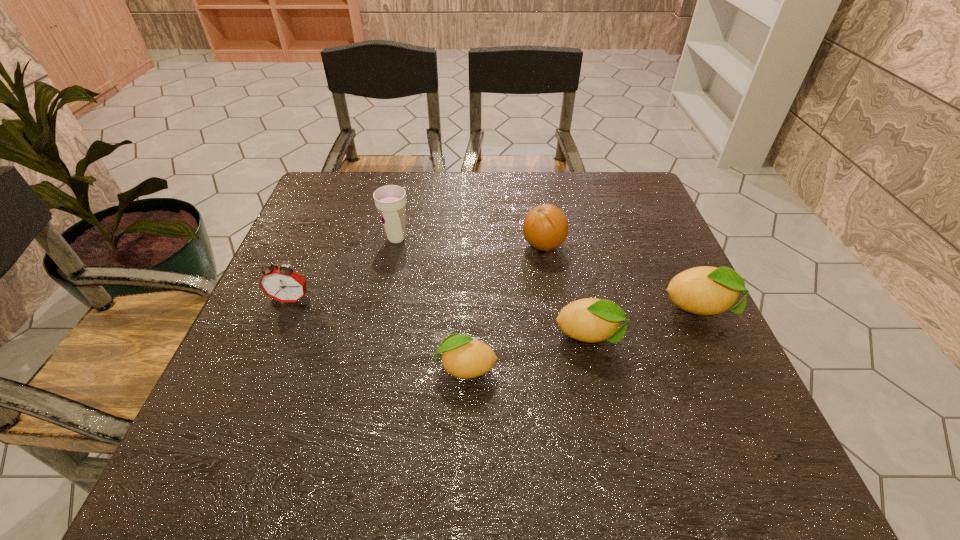
Find the location of `free area in between the fourth object from right to left and the alarm clock`. free area in between the fourth object from right to left and the alarm clock is located at coordinates (378, 334).

The width and height of the screenshot is (960, 540). Identify the location of vacant space in between the orange and the rightmost object. (622, 278).

I want to click on vacant space that is in between the orange and the shortest lemon, so click(x=504, y=306).

I want to click on the second closest object relative to the orange, so click(x=705, y=290).

This screenshot has width=960, height=540. Find the location of `the closest object to the cup`. the closest object to the cup is located at coordinates (283, 284).

Where is `lemon that is the second closest to the fifth object from right to left`? This screenshot has height=540, width=960. lemon that is the second closest to the fifth object from right to left is located at coordinates (591, 320).

Identify the location of the closest lemon to the alarm clock. The width and height of the screenshot is (960, 540). (463, 357).